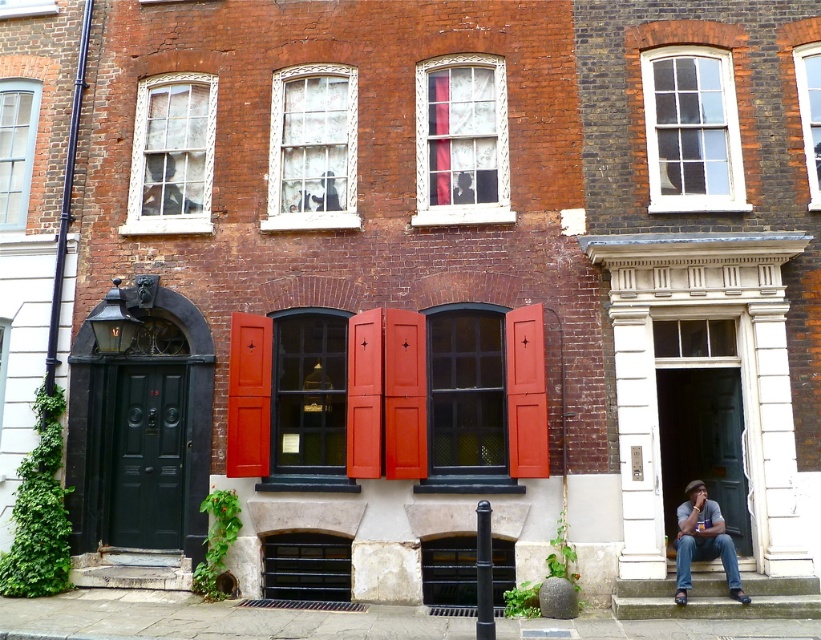
You are an architect analyzing the building facade. You need to determine which window has a greater height between the matte glass window at upper left and the clear glass window at center. Based on the scene description, which one is taller?

The clear glass window at center is taller than the matte glass window at upper left according to the description.

Consider the image. You are an architect analyzing the building structure. You notice the white textured window at upper left and the denim jeans at lower right. Which object occupies a greater area in the image?

The white textured window at upper left has a larger size compared to denim jeans at lower right, so it occupies a greater area in the image.

Looking at this image, you are standing in front of the historic building and want to locate the white textured window at upper left. According to the coordinates provided, where exactly would you look on the building?

The white textured window at upper left is located at coordinates point 0.244 on the x axis and 0.211 on the y axis.